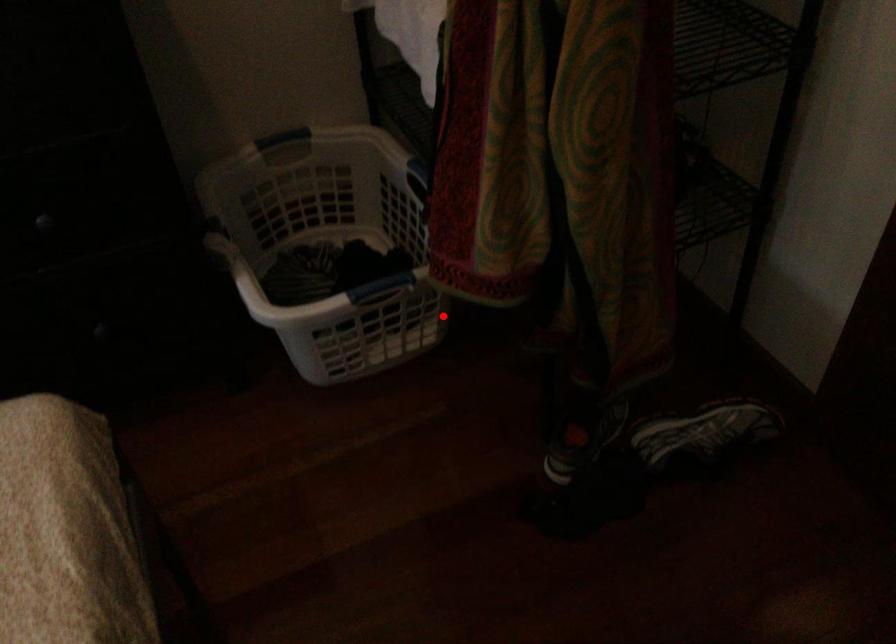
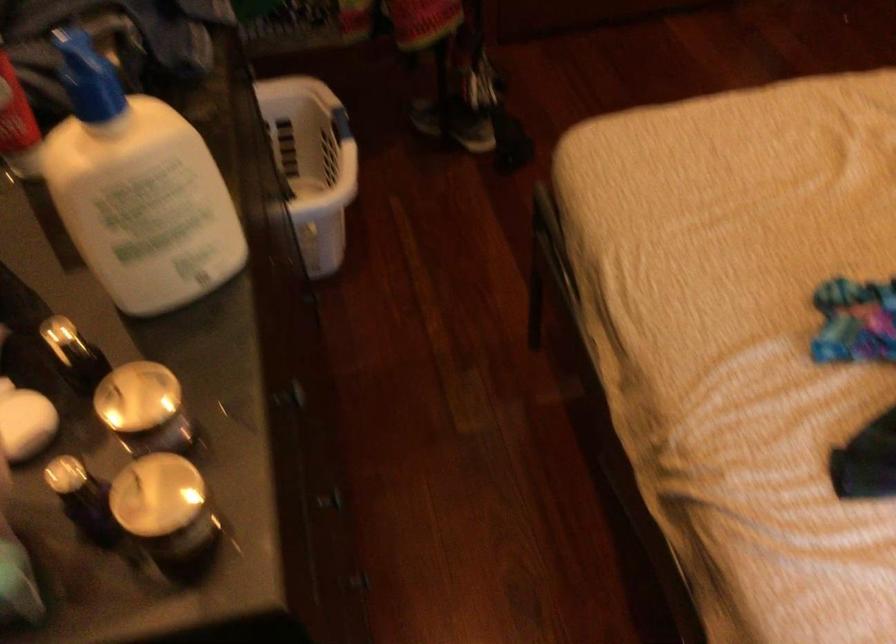
Question: A red point is marked in image1. In image2, is the corresponding 3D point closer to the camera or farther? Reply with the corresponding letter.

Choices:
 (A) The corresponding 3D point is closer.
 (B) The corresponding 3D point is farther.

Answer: (B)